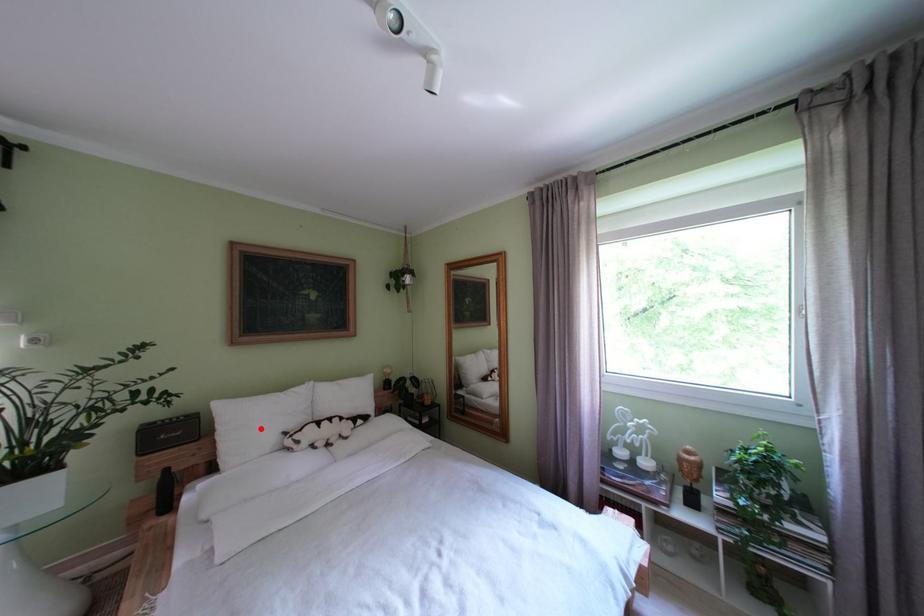
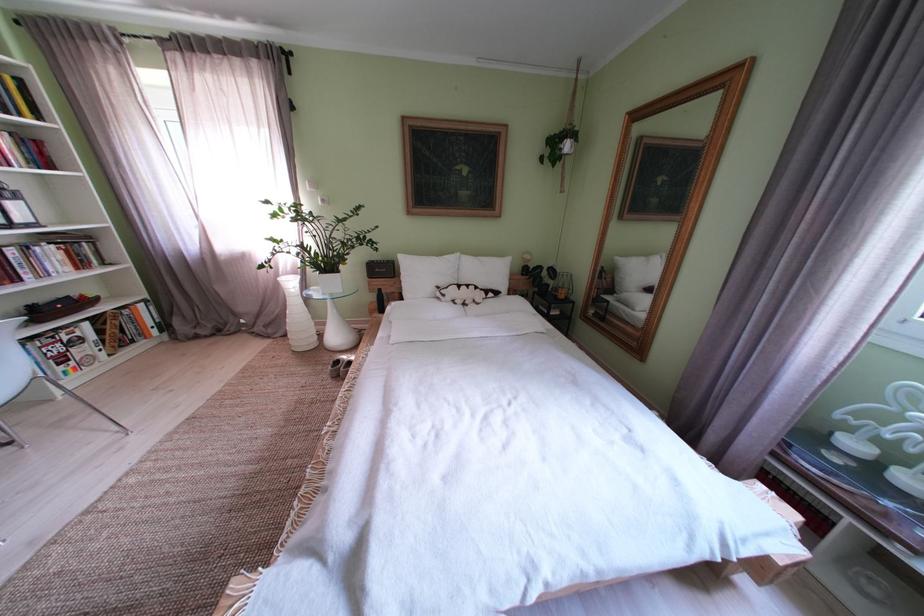
In the second image, find the point that corresponds to the highlighted location in the first image.

(429, 280)